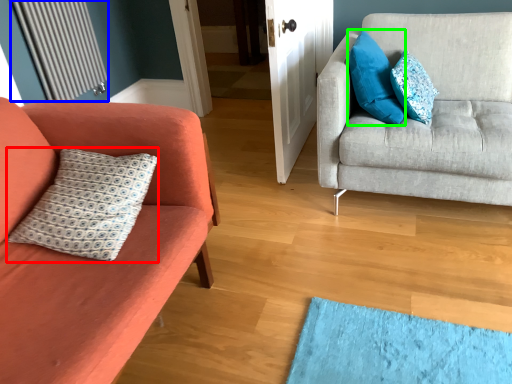
Question: Based on their relative distances, which object is farther from pillow (highlighted by a red box)? Choose from radiator (highlighted by a blue box) and pillow (highlighted by a green box).

Choices:
 (A) radiator
 (B) pillow

Answer: (A)